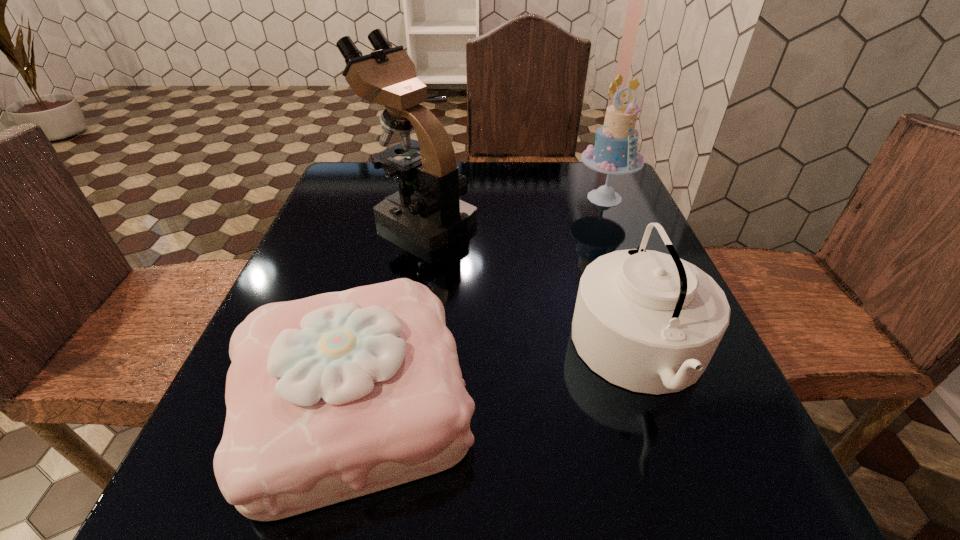
Find the location of a particular element. free space located 0.080m on the spout of the third tallest object is located at coordinates (525, 353).

This screenshot has height=540, width=960. I want to click on blank area located 0.340m on the right of the shorter cake, so click(x=706, y=401).

This screenshot has width=960, height=540. I want to click on microscope that is at the far edge, so click(x=427, y=211).

Where is `cake that is positioned at the far edge`? The image size is (960, 540). cake that is positioned at the far edge is located at coordinates (615, 152).

Locate an element on the screen. This screenshot has width=960, height=540. object that is at the near edge is located at coordinates (331, 397).

Identify the location of microscope that is at the left edge. (427, 211).

The height and width of the screenshot is (540, 960). Identify the location of cake that is positioned at the left edge. click(331, 397).

Locate an element on the screen. Image resolution: width=960 pixels, height=540 pixels. cake that is at the right edge is located at coordinates (615, 152).

In order to click on kettle present at the right edge in this screenshot , I will do coord(650,322).

You are a GUI agent. You are given a task and a screenshot of the screen. Output one action in this format:
    pyautogui.click(x=<x>, y=<y>)
    Task: Click on the object located in the far left corner section of the desktop
    The width and height of the screenshot is (960, 540).
    Given the screenshot: What is the action you would take?
    pyautogui.click(x=427, y=211)